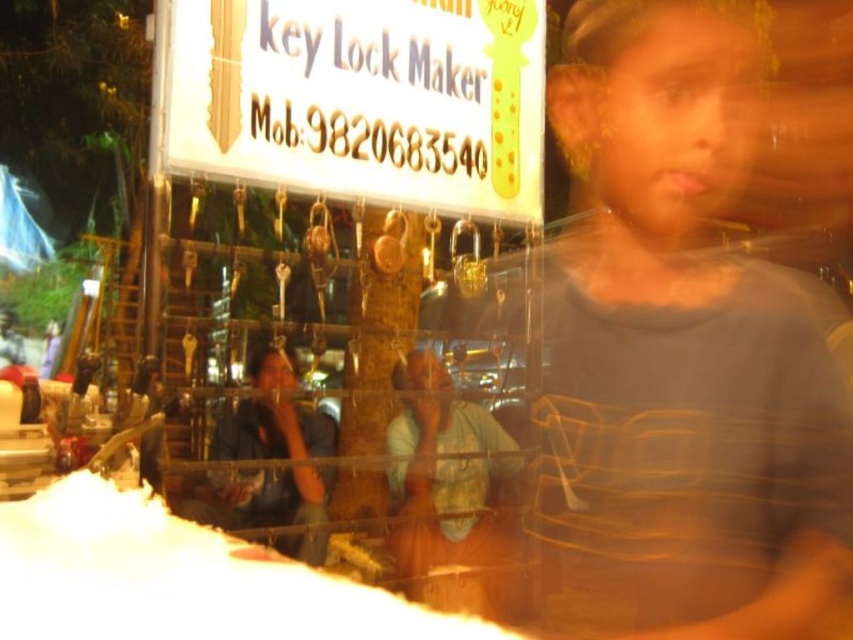
Does blue fabric shirt at center appear under black leather jacket at lower left?

Actually, blue fabric shirt at center is above black leather jacket at lower left.

Is blue fabric shirt at center thinner than black leather jacket at lower left?

Correct, blue fabric shirt at center's width is less than black leather jacket at lower left's.

Who is more distant from viewer, (404, 566) or (270, 444)?

Positioned behind is point (270, 444).

Where is `blue fabric shirt at center`? This screenshot has width=853, height=640. blue fabric shirt at center is located at coordinates pyautogui.click(x=444, y=476).